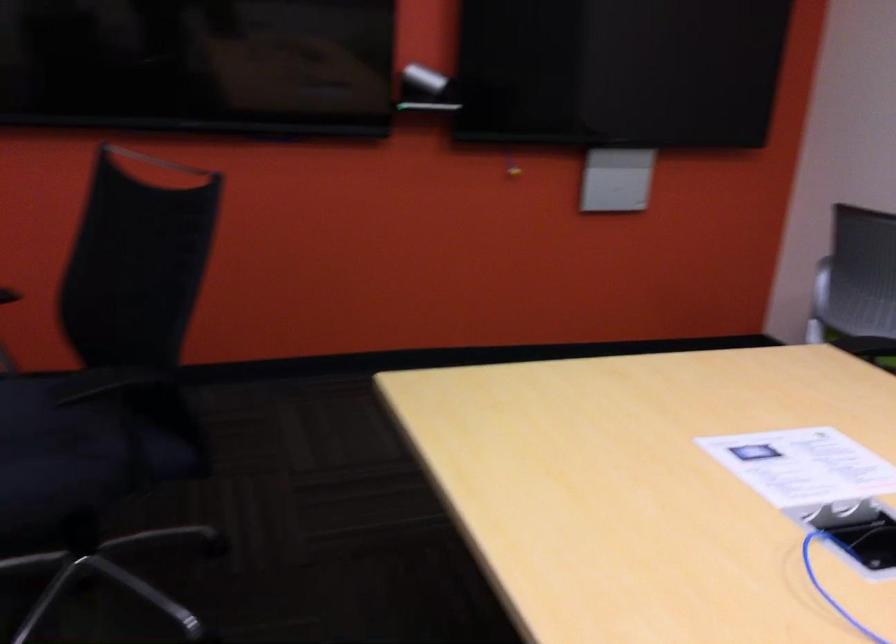
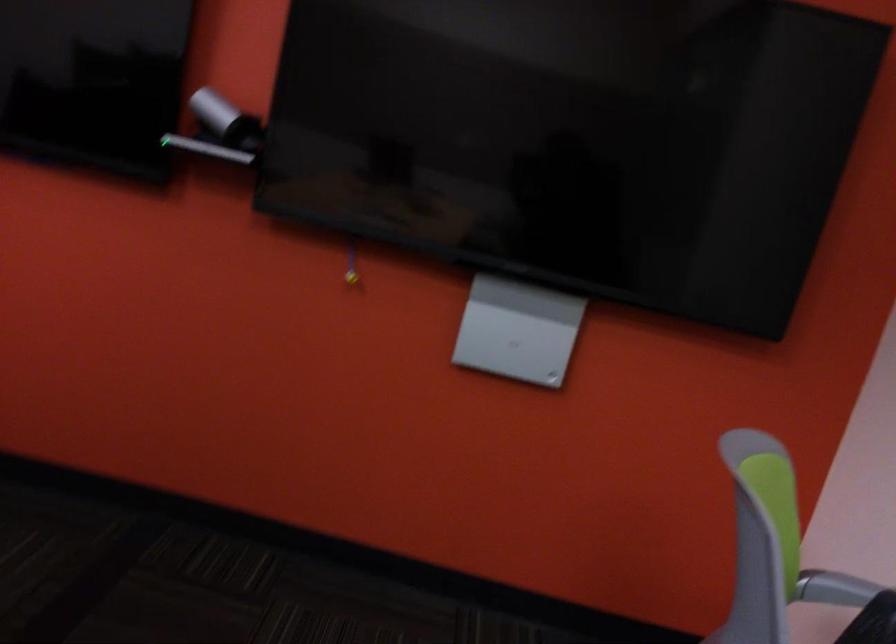
What movement of the cameraman would produce the second image?

The movement direction of the cameraman is right, forward.